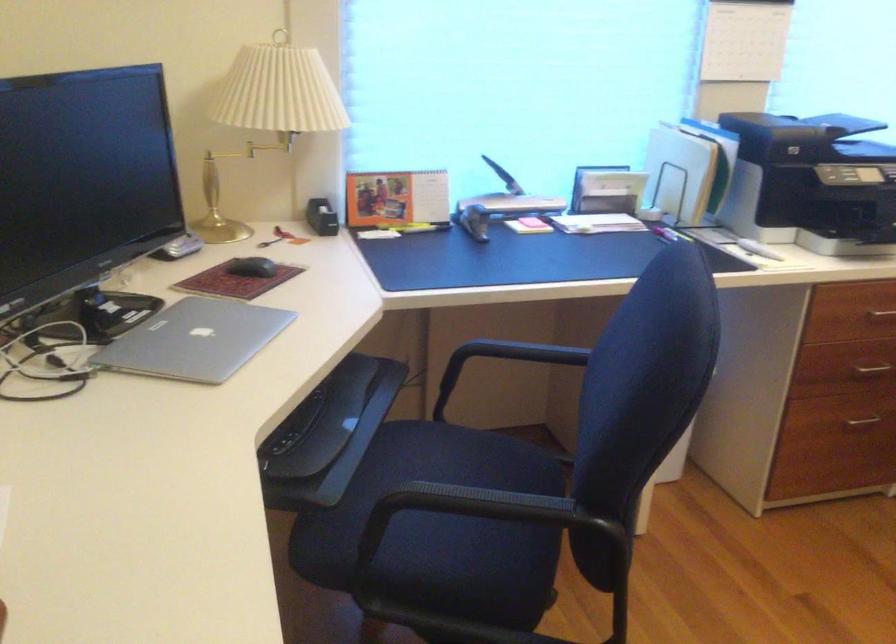
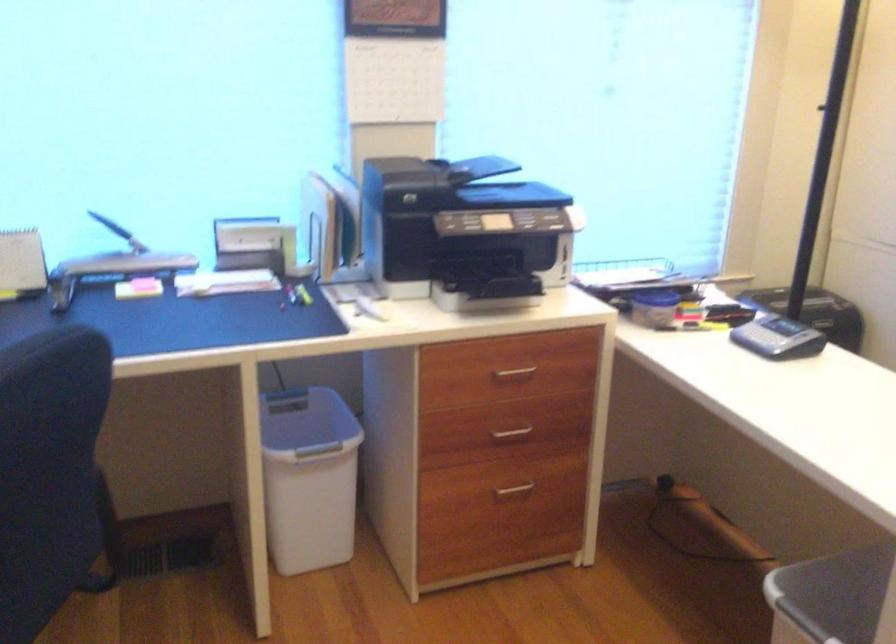
Question: Which direction would the cameraman need to move to produce the second image? Reply with the corresponding letter.

Choices:
 (A) Left
 (B) Right
 (C) Forward
 (D) Backward

Answer: (B)